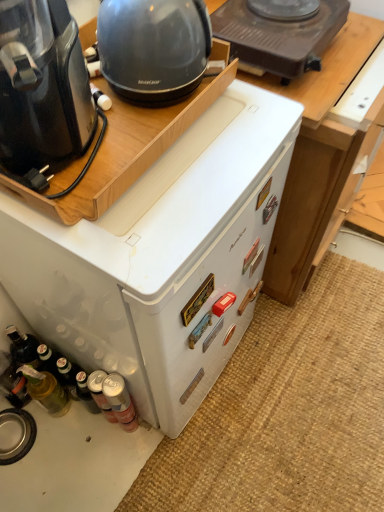
Question: Is matte black kettle at upper left wider than metallic silver can at lower left, arranged as the 2th bottle when viewed from the left?

Choices:
 (A) yes
 (B) no

Answer: (A)

Question: Does matte black kettle at upper left have a smaller size compared to metallic silver can at lower left, which is the second bottle from right to left?

Choices:
 (A) no
 (B) yes

Answer: (A)

Question: Considering the relative sizes of matte black kettle at upper left and metallic silver can at lower left, arranged as the 2th bottle when viewed from the left, in the image provided, is matte black kettle at upper left shorter than metallic silver can at lower left, arranged as the 2th bottle when viewed from the left,?

Choices:
 (A) no
 (B) yes

Answer: (B)

Question: Is matte black kettle at upper left not within metallic silver can at lower left, which is the second bottle from right to left?

Choices:
 (A) yes
 (B) no

Answer: (A)

Question: Are matte black kettle at upper left and metallic silver can at lower left, which is the second bottle from right to left, located far from each other?

Choices:
 (A) yes
 (B) no

Answer: (B)

Question: Is matte black kettle at upper left at the right side of metallic silver can at lower left, arranged as the 2th bottle when viewed from the left?

Choices:
 (A) yes
 (B) no

Answer: (A)

Question: Considering the relative positions of translucent glass bottle at lower left, acting as the first bottle starting from the left, and white matte refrigerator at center, the 1th home appliance in the back-to-front sequence, in the image provided, is translucent glass bottle at lower left, acting as the first bottle starting from the left, behind white matte refrigerator at center, the 1th home appliance in the back-to-front sequence,?

Choices:
 (A) no
 (B) yes

Answer: (B)

Question: Is white matte refrigerator at center, the 1th home appliance in the back-to-front sequence, located within translucent glass bottle at lower left, acting as the first bottle starting from the left?

Choices:
 (A) yes
 (B) no

Answer: (B)

Question: Does translucent glass bottle at lower left, which is the third bottle in right-to-left order, have a greater width compared to white matte refrigerator at center, the 1th home appliance in the back-to-front sequence?

Choices:
 (A) no
 (B) yes

Answer: (A)

Question: Is translucent glass bottle at lower left, acting as the first bottle starting from the left, positioned with its back to white matte refrigerator at center, the 1th home appliance in the back-to-front sequence?

Choices:
 (A) no
 (B) yes

Answer: (A)

Question: Can you confirm if translucent glass bottle at lower left, which is the third bottle in right-to-left order, is bigger than white matte refrigerator at center, the 1th home appliance in the back-to-front sequence?

Choices:
 (A) no
 (B) yes

Answer: (A)

Question: Can you confirm if translucent glass bottle at lower left, which is the third bottle in right-to-left order, is shorter than white matte refrigerator at center, the 1th home appliance in the back-to-front sequence?

Choices:
 (A) yes
 (B) no

Answer: (A)

Question: Is metallic silver can at lower left, which is the second bottle from right to left, in front of black plastic coffee maker at left, marked as the second home appliance in a back-to-front arrangement?

Choices:
 (A) yes
 (B) no

Answer: (B)